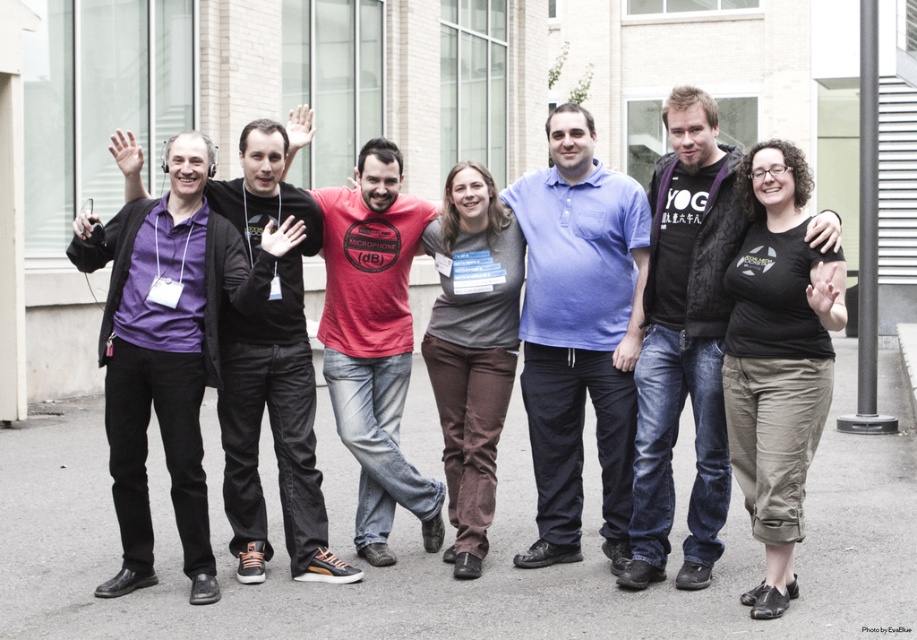
Between point (238, 426) and point (488, 337), which one is positioned in front?

Point (238, 426) is more forward.

Who is more distant from viewer, (251, 396) or (428, 228)?

The point (428, 228) is more distant.

Does point (299, 436) lie in front of point (467, 458)?

Yes, point (299, 436) is closer to viewer.

At what (x,y) coordinates should I click in order to perform the action: click on purple matte shirt at left. Please return your answer as a coordinate pair (x, y). This screenshot has height=640, width=917. Looking at the image, I should click on (272, 369).

Between blue cotton polo shirt at center and black cotton shirt at center, which one is positioned higher?

blue cotton polo shirt at center is higher up.

Can you confirm if blue cotton polo shirt at center is thinner than black cotton shirt at center?

No.

Who is more distant from viewer, (553, 140) or (775, 310)?

The point (553, 140) is more distant.

This screenshot has width=917, height=640. Identify the location of blue cotton polo shirt at center. (579, 332).

Does black cotton shirt at center have a lesser width compared to purple matte shirt at left?

Yes, black cotton shirt at center is thinner than purple matte shirt at left.

Between point (785, 556) and point (296, 339), which one is positioned behind?

Point (296, 339)

Locate an element on the screen. Image resolution: width=917 pixels, height=640 pixels. black cotton shirt at center is located at coordinates pos(777,360).